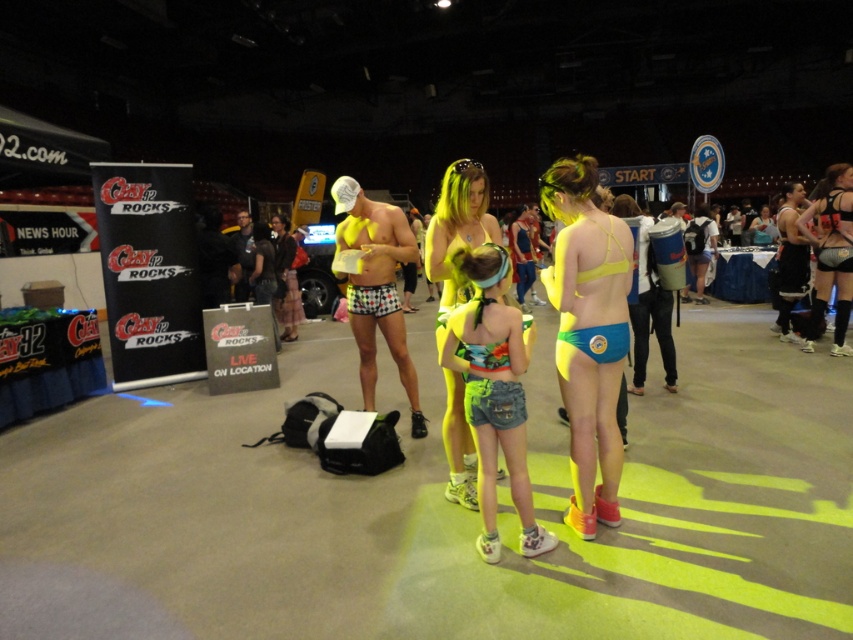
You are a photographer at the event and need to capture a clear shot of both the neon yellow bikini top at center and the neon yellow bikini at center. Given their height difference, which one will appear larger in your photo?

The neon yellow bikini top at center appears larger in the photo because it is much taller than the neon yellow bikini at center.

You are a photographer at the event and need to position yourself so that both the neon yellow fabric shorts at center and the neon yellow bikini at center are in your shot. Based on their positions, which one should you focus on first to ensure both are framed properly?

Since the neon yellow fabric shorts at center is to the left of neon yellow bikini at center, you should focus on the neon yellow bikini at center first as it is on the right side, allowing you to adjust your frame to include both from left to right.

You are a photographer at the event and need to position your camera to capture the neon yellow fabric shorts at center. According to the coordinates provided, where should you aim your camera?

You should aim your camera at point (376, 288) to capture the neon yellow fabric shorts at center.